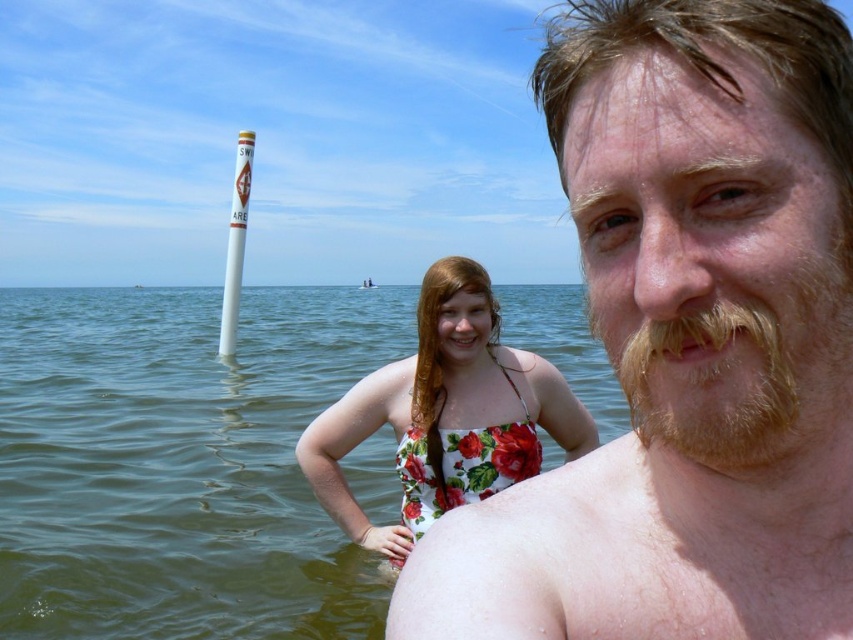
Can you confirm if greenish water at center is thinner than light brown fuzzy beard at right?

Incorrect, greenish water at center's width is not less than light brown fuzzy beard at right's.

You are a GUI agent. You are given a task and a screenshot of the screen. Output one action in this format:
    pyautogui.click(x=<x>, y=<y>)
    Task: Click on the greenish water at center
    
    Given the screenshot: What is the action you would take?
    pos(180,461)

You are a GUI agent. You are given a task and a screenshot of the screen. Output one action in this format:
    pyautogui.click(x=<x>, y=<y>)
    Task: Click on the greenish water at center
    The width and height of the screenshot is (853, 640).
    Given the screenshot: What is the action you would take?
    pyautogui.click(x=180, y=461)

Between smooth skin torso at center and floral print swimsuit at center, which one is positioned lower?

Positioned lower is floral print swimsuit at center.

Can you confirm if smooth skin torso at center is wider than floral print swimsuit at center?

Incorrect, smooth skin torso at center's width does not surpass floral print swimsuit at center's.

At what (x,y) coordinates should I click in order to perform the action: click on smooth skin torso at center. Please return your answer as a coordinate pair (x, y). The height and width of the screenshot is (640, 853). Looking at the image, I should click on (643, 552).

You are a GUI agent. You are given a task and a screenshot of the screen. Output one action in this format:
    pyautogui.click(x=<x>, y=<y>)
    Task: Click on the smooth skin torso at center
    
    Given the screenshot: What is the action you would take?
    pyautogui.click(x=643, y=552)

How distant is smooth skin torso at center from light brown fuzzy beard at right?

A distance of 4.43 inches exists between smooth skin torso at center and light brown fuzzy beard at right.

Image resolution: width=853 pixels, height=640 pixels. What do you see at coordinates (643, 552) in the screenshot? I see `smooth skin torso at center` at bounding box center [643, 552].

You are a GUI agent. You are given a task and a screenshot of the screen. Output one action in this format:
    pyautogui.click(x=<x>, y=<y>)
    Task: Click on the smooth skin torso at center
    
    Given the screenshot: What is the action you would take?
    pyautogui.click(x=643, y=552)